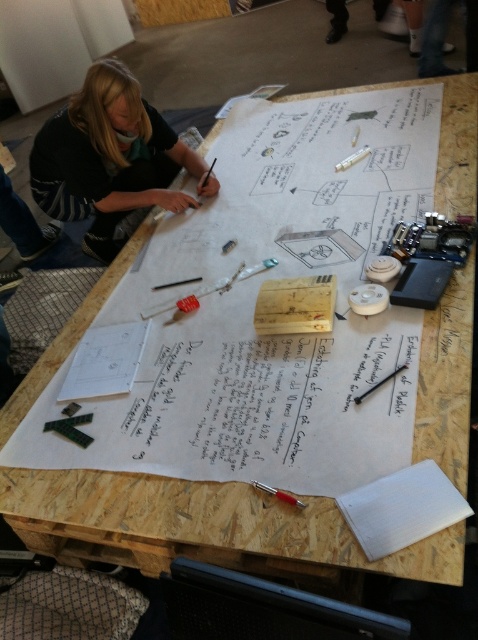
Looking at this image, you are observing a workspace where a woman is working on a large sheet of paper. You see the blonde hair at upper left and the metallic red pen at lower center. Which object is positioned more to the left?

The blonde hair at upper left is positioned more to the left than the metallic red pen at lower center.